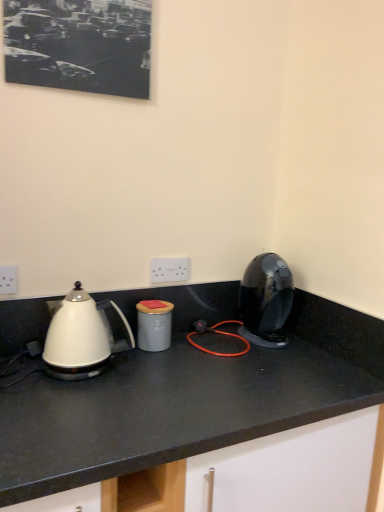
Question: Is black matte picture frame at upper left positioned with its back to gray matte canister at center?

Choices:
 (A) no
 (B) yes

Answer: (A)

Question: Is black matte picture frame at upper left smaller than gray matte canister at center?

Choices:
 (A) yes
 (B) no

Answer: (B)

Question: Does black matte picture frame at upper left appear on the left side of gray matte canister at center?

Choices:
 (A) yes
 (B) no

Answer: (A)

Question: From the image's perspective, is black matte picture frame at upper left located beneath gray matte canister at center?

Choices:
 (A) yes
 (B) no

Answer: (B)

Question: Is black matte picture frame at upper left in contact with gray matte canister at center?

Choices:
 (A) no
 (B) yes

Answer: (A)

Question: In the image, is white plastic electric outlet at left, which ranks as the first electric outlet in left-to-right order, positioned in front of or behind black matte picture frame at upper left?

Choices:
 (A) front
 (B) behind

Answer: (B)

Question: From the image's perspective, is white plastic electric outlet at left, arranged as the 1th electric outlet when viewed from the front, above or below black matte picture frame at upper left?

Choices:
 (A) below
 (B) above

Answer: (A)

Question: In terms of height, does white plastic electric outlet at left, which is the 2th electric outlet from right to left, look taller or shorter compared to black matte picture frame at upper left?

Choices:
 (A) short
 (B) tall

Answer: (A)

Question: From a real-world perspective, relative to black matte picture frame at upper left, is white plastic electric outlet at left, which is the 2th electric outlet from right to left, vertically above or below?

Choices:
 (A) above
 (B) below

Answer: (B)

Question: In terms of width, does white plastic electric outlet at center, which ranks as the first electric outlet in right-to-left order, look wider or thinner when compared to white glossy kettle at left?

Choices:
 (A) wide
 (B) thin

Answer: (B)

Question: Looking at the image, does white plastic electric outlet at center, which ranks as the 1th electric outlet in back-to-front order, seem bigger or smaller compared to white glossy kettle at left?

Choices:
 (A) small
 (B) big

Answer: (A)

Question: From the image's perspective, is white plastic electric outlet at center, which ranks as the 1th electric outlet in back-to-front order, located above or below white glossy kettle at left?

Choices:
 (A) above
 (B) below

Answer: (A)

Question: Is white plastic electric outlet at center, which is the 2th electric outlet in left-to-right order, to the left or to the right of white glossy kettle at left in the image?

Choices:
 (A) left
 (B) right

Answer: (B)

Question: Considering the positions of point (165, 311) and point (3, 271), is point (165, 311) closer or farther from the camera than point (3, 271)?

Choices:
 (A) farther
 (B) closer

Answer: (A)

Question: From the image's perspective, is gray matte canister at center located above or below white plastic electric outlet at left, which ranks as the first electric outlet in left-to-right order?

Choices:
 (A) above
 (B) below

Answer: (B)